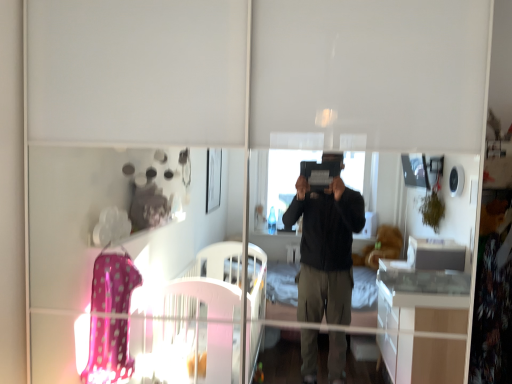
What do you see at coordinates (492, 215) in the screenshot? I see `matte black camera at center` at bounding box center [492, 215].

This screenshot has width=512, height=384. What are the coordinates of `matte black camera at center` in the screenshot? It's located at (492, 215).

The image size is (512, 384). What are the coordinates of `matte black camera at center` in the screenshot? It's located at (492, 215).